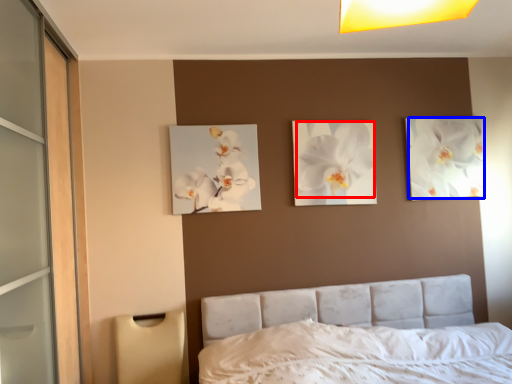
Question: Which object appears farthest to the camera in this image, flower (highlighted by a red box) or flower (highlighted by a blue box)?

Choices:
 (A) flower
 (B) flower

Answer: (B)